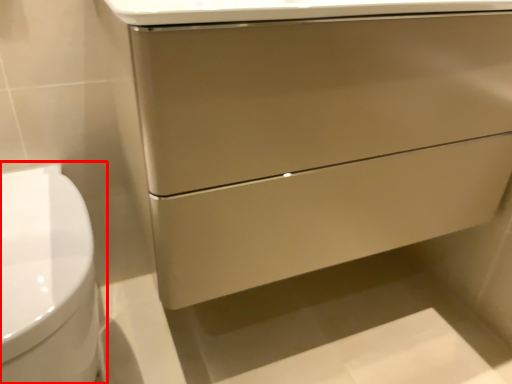
Question: From the image, what is the correct spatial relationship of toilet (annotated by the red box) in relation to drawer?

Choices:
 (A) left
 (B) right

Answer: (A)